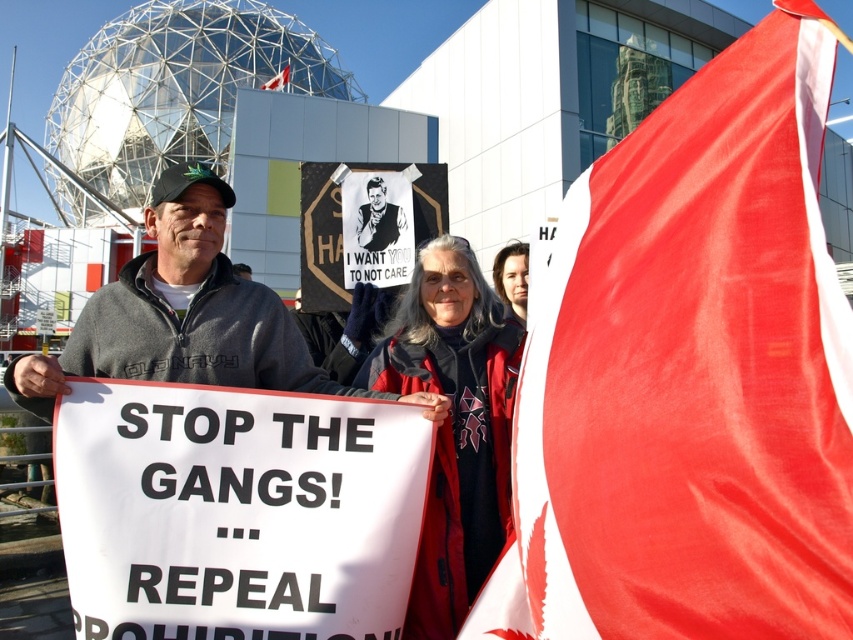
Can you confirm if red fabric flag at center is taller than red fabric flag at upper right?

Yes.

Looking at this image, does red fabric flag at center appear over red fabric flag at upper right?

No, red fabric flag at center is not above red fabric flag at upper right.

You are a GUI agent. You are given a task and a screenshot of the screen. Output one action in this format:
    pyautogui.click(x=<x>, y=<y>)
    Task: Click on the red fabric flag at center
    The width and height of the screenshot is (853, 640).
    Given the screenshot: What is the action you would take?
    coord(689,374)

Does matte black jacket at center have a larger size compared to red fabric flag at upper right?

No.

Which is behind, point (509, 275) or point (276, 80)?

Positioned behind is point (276, 80).

Between point (500, 291) and point (276, 81), which one is positioned in front?

Point (500, 291) is more forward.

The width and height of the screenshot is (853, 640). In order to click on matte black jacket at center in this screenshot , I will do `click(512, 278)`.

Does point (471, 436) come closer to viewer compared to point (509, 308)?

Yes, point (471, 436) is closer to viewer.

Can you confirm if red wool scarf at center is wider than matte black jacket at center?

Yes, red wool scarf at center is wider than matte black jacket at center.

Who is more forward, (442,561) or (508,294)?

Point (442,561) is in front.

The image size is (853, 640). Identify the location of red wool scarf at center. (454, 424).